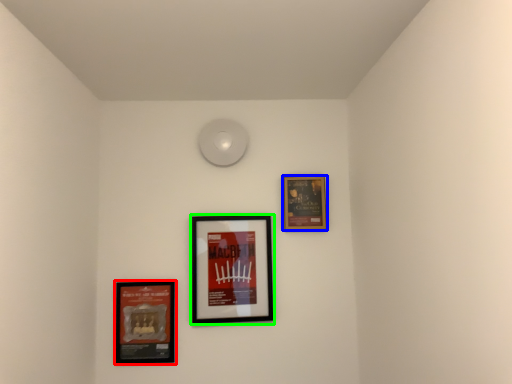
Question: Which object is positioned closest to picture frame (highlighted by a red box)? Select from picture frame (highlighted by a blue box) and picture frame (highlighted by a green box).

Choices:
 (A) picture frame
 (B) picture frame

Answer: (B)